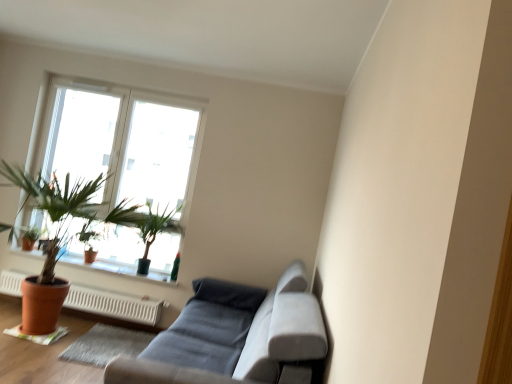
Question: Is matte terracotta pot at left, positioned as the first houseplant in back-to-front order, directly adjacent to transparent glass window at upper left?

Choices:
 (A) yes
 (B) no

Answer: (B)

Question: Is matte terracotta pot at left, positioned as the first houseplant in back-to-front order, wider than transparent glass window at upper left?

Choices:
 (A) no
 (B) yes

Answer: (A)

Question: Considering the relative positions of matte terracotta pot at left, positioned as the first houseplant in back-to-front order, and transparent glass window at upper left in the image provided, is matte terracotta pot at left, positioned as the first houseplant in back-to-front order, to the right of transparent glass window at upper left from the viewer's perspective?

Choices:
 (A) yes
 (B) no

Answer: (B)

Question: Considering the relative sizes of matte terracotta pot at left, positioned as the first houseplant in back-to-front order, and transparent glass window at upper left in the image provided, is matte terracotta pot at left, positioned as the first houseplant in back-to-front order, taller than transparent glass window at upper left?

Choices:
 (A) no
 (B) yes

Answer: (A)

Question: Is matte terracotta pot at left, positioned as the first houseplant in back-to-front order, not near transparent glass window at upper left?

Choices:
 (A) no
 (B) yes

Answer: (B)

Question: Is transparent glass window at upper left at the back of matte terracotta pot at left, placed as the third houseplant when sorted from front to back?

Choices:
 (A) no
 (B) yes

Answer: (B)

Question: Considering the relative positions of matte terracotta pot at left, placed as the third houseplant when sorted from front to back, and green matte plant at upper left, the 2th houseplant when ordered from back to front, in the image provided, is matte terracotta pot at left, placed as the third houseplant when sorted from front to back, to the left of green matte plant at upper left, the 2th houseplant when ordered from back to front, from the viewer's perspective?

Choices:
 (A) yes
 (B) no

Answer: (A)

Question: Is matte terracotta pot at left, positioned as the first houseplant in back-to-front order, to the right of green matte plant at upper left, the second houseplant from the front, from the viewer's perspective?

Choices:
 (A) yes
 (B) no

Answer: (B)

Question: Considering the relative sizes of matte terracotta pot at left, placed as the third houseplant when sorted from front to back, and green matte plant at upper left, the second houseplant from the front, in the image provided, is matte terracotta pot at left, placed as the third houseplant when sorted from front to back, shorter than green matte plant at upper left, the second houseplant from the front,?

Choices:
 (A) no
 (B) yes

Answer: (B)

Question: Can you confirm if matte terracotta pot at left, placed as the third houseplant when sorted from front to back, is wider than green matte plant at upper left, the second houseplant from the front?

Choices:
 (A) yes
 (B) no

Answer: (B)

Question: Can you confirm if matte terracotta pot at left, placed as the third houseplant when sorted from front to back, is bigger than green matte plant at upper left, the 2th houseplant when ordered from back to front?

Choices:
 (A) yes
 (B) no

Answer: (B)

Question: Is transparent glass window at upper left facing away from green matte plant at upper left, the 2th houseplant when ordered from back to front?

Choices:
 (A) yes
 (B) no

Answer: (A)